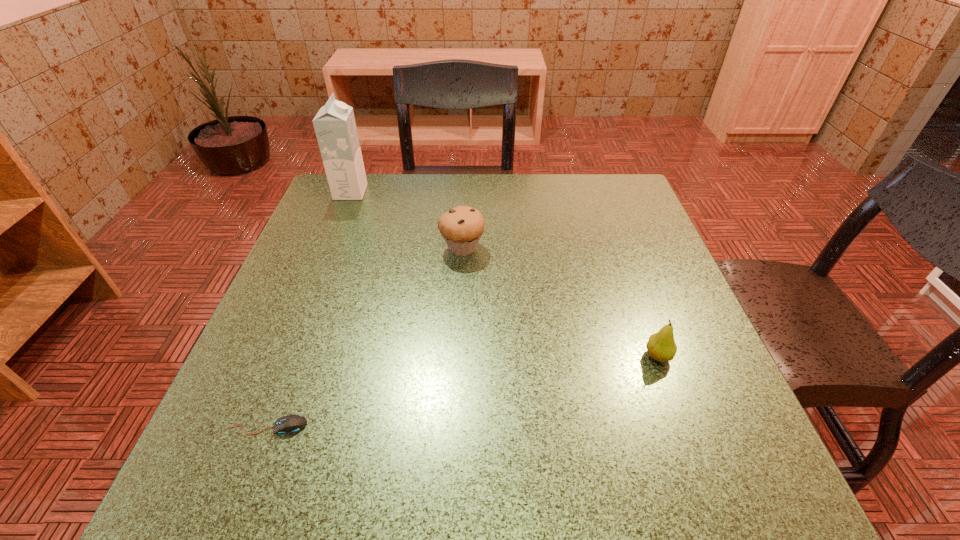
Locate an element on the screen. vacant area situated on the right of the pear is located at coordinates (699, 356).

Where is `free region located 0.270m on the right of the shortest object`? The height and width of the screenshot is (540, 960). free region located 0.270m on the right of the shortest object is located at coordinates (479, 426).

The width and height of the screenshot is (960, 540). Identify the location of object at the far edge. (x=335, y=127).

Identify the location of carton present at the left edge. (335, 127).

Locate an element on the screen. mouse at the left edge is located at coordinates (291, 424).

Where is `object located at the right edge`? object located at the right edge is located at coordinates (661, 346).

At what (x,y) coordinates should I click in order to perform the action: click on object that is at the far left corner. Please return your answer as a coordinate pair (x, y). The height and width of the screenshot is (540, 960). Looking at the image, I should click on (335, 127).

In the image, there is a desktop. At what (x,y) coordinates should I click in order to perform the action: click on vacant region at the far edge. Please return your answer as a coordinate pair (x, y). Looking at the image, I should click on (535, 218).

This screenshot has height=540, width=960. I want to click on free space at the near edge of the desktop, so click(x=633, y=464).

Locate an element on the screen. The height and width of the screenshot is (540, 960). vacant space at the left edge is located at coordinates (333, 263).